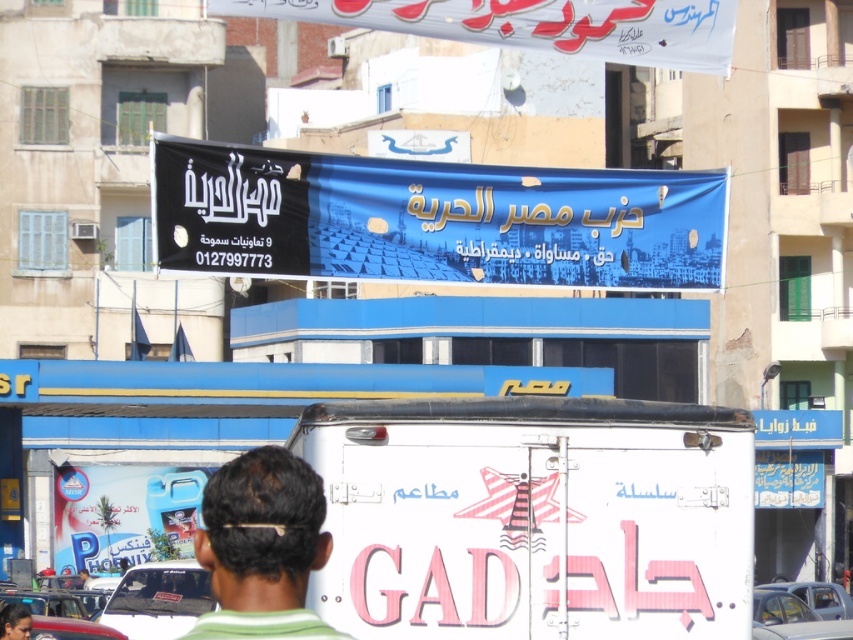
Question: Considering the relative positions of dark brown hair at center and dark brown hair at upper center in the image provided, where is dark brown hair at center located with respect to dark brown hair at upper center?

Choices:
 (A) below
 (B) above

Answer: (B)

Question: Is white glossy food truck at center bigger than blue fabric banner at center?

Choices:
 (A) yes
 (B) no

Answer: (B)

Question: Which point is closer to the camera?

Choices:
 (A) (253, 560)
 (B) (16, 627)

Answer: (A)

Question: Which of the following is the closest to the observer?

Choices:
 (A) dark brown hair at upper center
 (B) white glossy food truck at center

Answer: (B)

Question: Is white glossy food truck at center thinner than blue fabric banner at center?

Choices:
 (A) yes
 (B) no

Answer: (A)

Question: Which point appears closest to the camera in this image?

Choices:
 (A) click(341, 632)
 (B) click(6, 628)
 (C) click(672, 211)
 (D) click(463, 477)

Answer: (A)